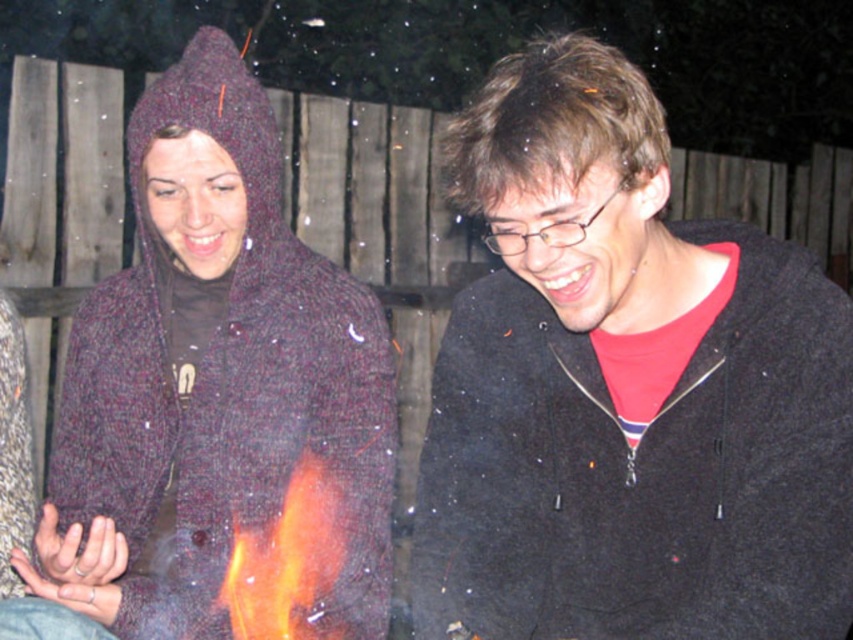
Is black matte jacket at center taller than knitted woolen sweater at left?

No, black matte jacket at center is not taller than knitted woolen sweater at left.

Is black matte jacket at center below knitted woolen sweater at left?

Yes.

Is point (611, 570) farther from viewer compared to point (241, 621)?

No, it is not.

This screenshot has height=640, width=853. I want to click on black matte jacket at center, so click(x=625, y=392).

Does black matte jacket at center appear under flamematerial/texture at center?

Incorrect, black matte jacket at center is not positioned below flamematerial/texture at center.

In order to click on black matte jacket at center in this screenshot , I will do `click(625, 392)`.

Which is more to the right, knitted woolen sweater at left or flamematerial/texture at center?

From the viewer's perspective, flamematerial/texture at center appears more on the right side.

Does point (279, 365) come farther from viewer compared to point (267, 612)?

Yes, it is behind point (267, 612).

Does point (366, 529) lie behind point (306, 632)?

That is True.

Locate an element on the screen. The width and height of the screenshot is (853, 640). knitted woolen sweater at left is located at coordinates (216, 404).